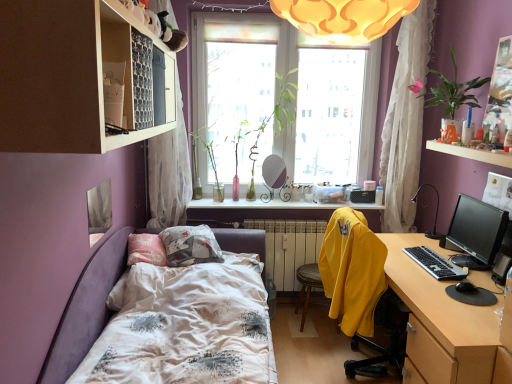
Question: Does point (180, 145) appear closer or farther from the camera than point (433, 264)?

Choices:
 (A) farther
 (B) closer

Answer: (A)

Question: Is white sheer curtain at left, placed as the 1th curtain when sorted from left to right, bigger or smaller than black plastic keyboard at right?

Choices:
 (A) big
 (B) small

Answer: (A)

Question: Based on their relative distances, which object is nearer to the pink glass vase at window, arranged as the third plant when viewed from the right?

Choices:
 (A) transparent glass window at center
 (B) black plastic keyboard at right
 (C) yellow fabric at lower right
 (D) black plastic table lamp at right
 (E) green glossy plant at center, acting as the third plant starting from the left

Answer: (E)

Question: Which object is positioned farthest from the pink glass vase at window, arranged as the third plant when viewed from the right?

Choices:
 (A) white sheer curtain at upper right, which is counted as the 2th curtain, starting from the left
 (B) green glossy plant at center, acting as the third plant starting from the left
 (C) transparent glass window at center
 (D) clear glass bottles at center, the second window sill in the top-to-bottom sequence
 (E) wooden desk at right

Answer: (E)